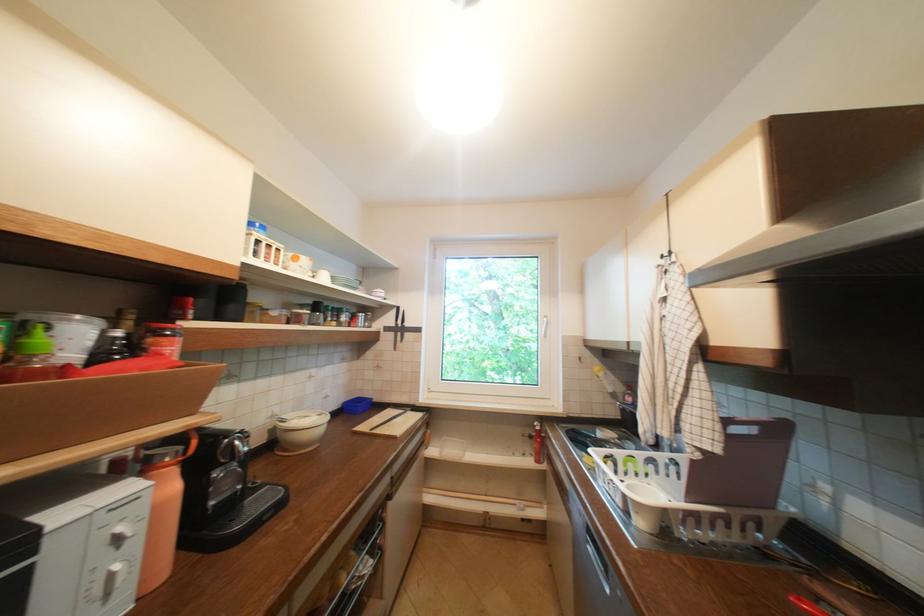
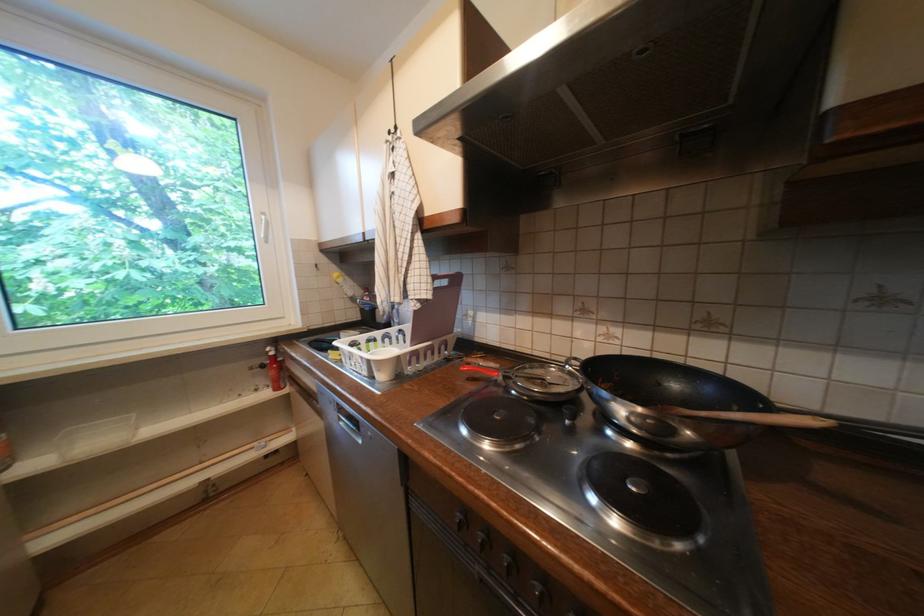
Question: The camera is either moving clockwise (left) or counter-clockwise (right) around the object. The first image is from the beginning of the video and the second image is from the end. Is the camera moving left or right when shooting the video?

Choices:
 (A) Left
 (B) Right

Answer: (A)